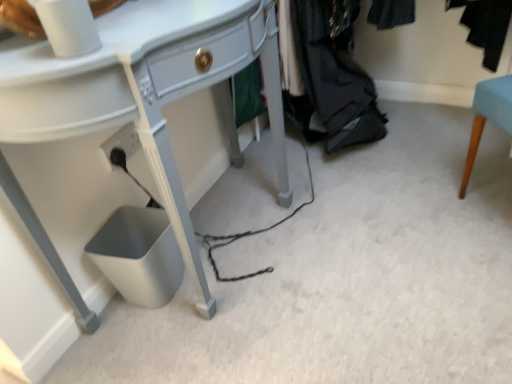
Question: From the image's perspective, is matte white desk at center on top of dark gray fabric at lower right?

Choices:
 (A) yes
 (B) no

Answer: (B)

Question: From the image's perspective, does matte white desk at center appear lower than dark gray fabric at lower right?

Choices:
 (A) yes
 (B) no

Answer: (A)

Question: Does matte white desk at center have a greater width compared to dark gray fabric at lower right?

Choices:
 (A) no
 (B) yes

Answer: (A)

Question: Can you confirm if matte white desk at center is bigger than dark gray fabric at lower right?

Choices:
 (A) yes
 (B) no

Answer: (A)

Question: Can you see matte white desk at center touching dark gray fabric at lower right?

Choices:
 (A) no
 (B) yes

Answer: (A)

Question: Does matte white desk at center lie in front of dark gray fabric at lower right?

Choices:
 (A) yes
 (B) no

Answer: (A)

Question: Is dark gray fabric at lower right positioned beyond the bounds of matte white desk at center?

Choices:
 (A) no
 (B) yes

Answer: (B)

Question: Can you confirm if dark gray fabric at lower right is wider than matte white desk at center?

Choices:
 (A) yes
 (B) no

Answer: (A)

Question: Is the depth of dark gray fabric at lower right less than that of matte white desk at center?

Choices:
 (A) yes
 (B) no

Answer: (B)

Question: Is dark gray fabric at lower right positioned with its back to matte white desk at center?

Choices:
 (A) yes
 (B) no

Answer: (B)

Question: Considering the relative sizes of dark gray fabric at lower right and matte white desk at center in the image provided, is dark gray fabric at lower right shorter than matte white desk at center?

Choices:
 (A) no
 (B) yes

Answer: (B)

Question: Would you say matte white desk at center is part of dark gray fabric at lower right's contents?

Choices:
 (A) no
 (B) yes

Answer: (A)

Question: Is matte white desk at center inside the boundaries of dark gray fabric at lower right, or outside?

Choices:
 (A) inside
 (B) outside

Answer: (B)